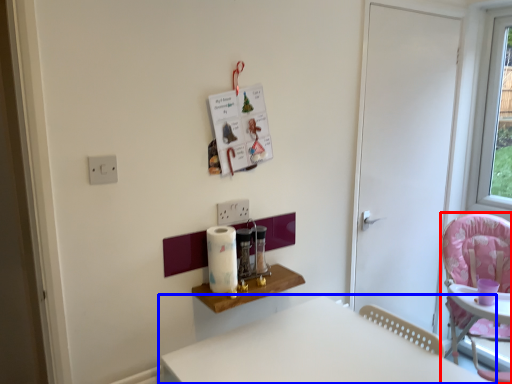
Question: Which of the following is the farthest to the observer, chair (highlighted by a red box) or table (highlighted by a blue box)?

Choices:
 (A) chair
 (B) table

Answer: (A)